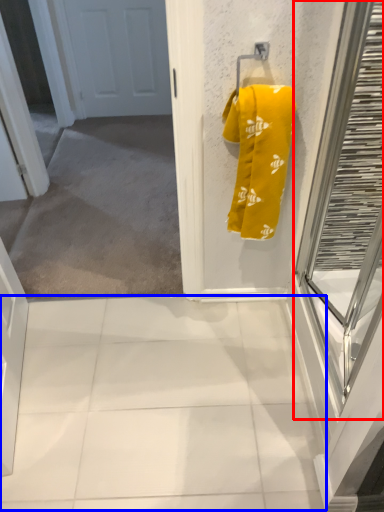
Question: Among these objects, which one is nearest to the camera, glass door (highlighted by a red box) or tile (highlighted by a blue box)?

Choices:
 (A) glass door
 (B) tile

Answer: (A)